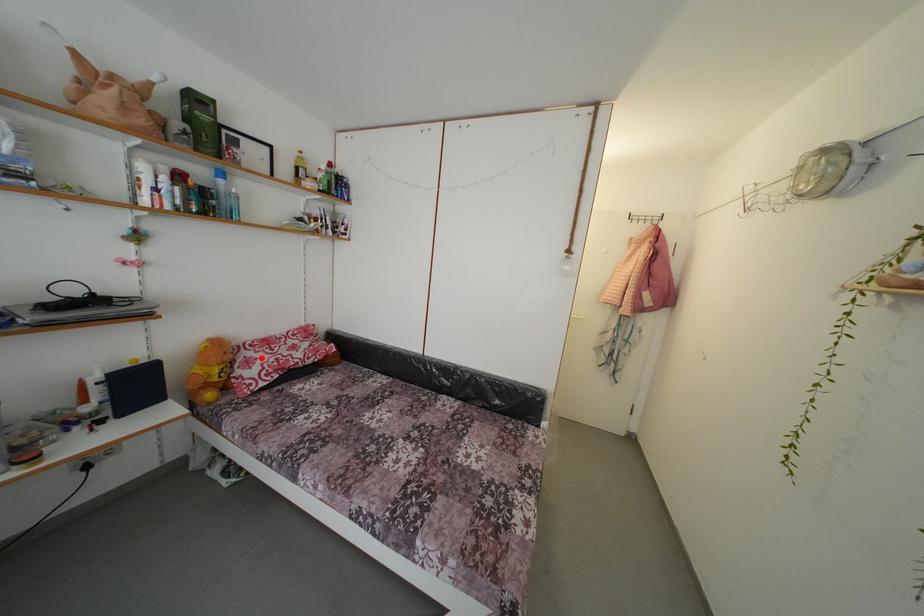
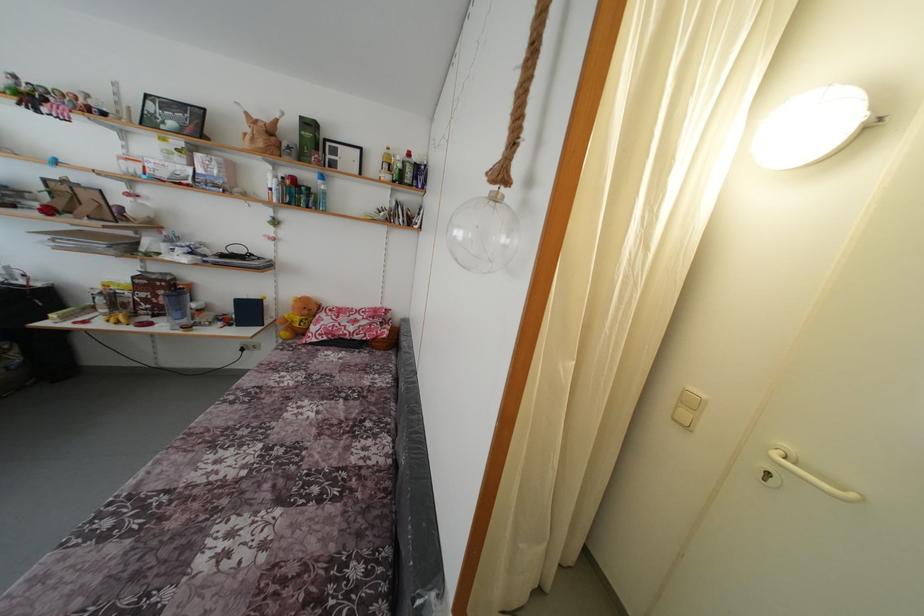
Find the pixel in the second image that matches the highlighted location in the first image.

(332, 321)